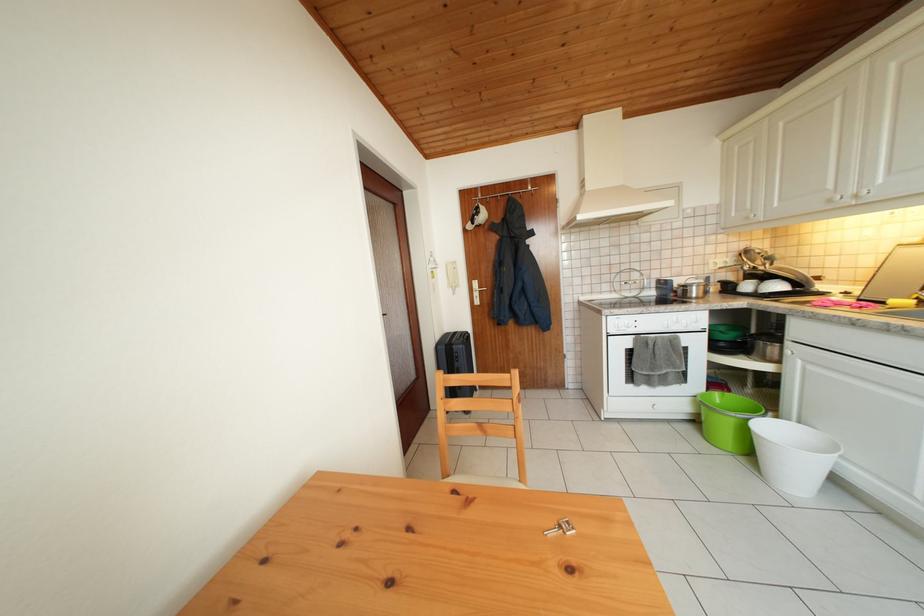
Find the location of `silver key`. silver key is located at coordinates (561, 528).